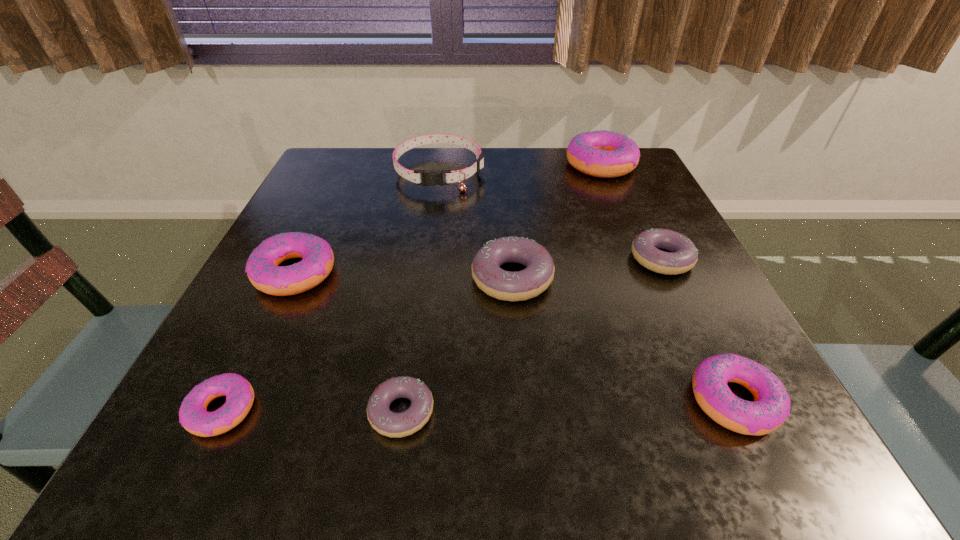
Identify the location of vacant area that lies between the smallest pink doughnut and the smallest purple doughnut. Image resolution: width=960 pixels, height=540 pixels. (312, 410).

You are a GUI agent. You are given a task and a screenshot of the screen. Output one action in this format:
    pyautogui.click(x=<x>, y=<y>)
    Task: Click on the vacant area that lies between the pink dog collar and the second farthest pink doughnut
    
    Given the screenshot: What is the action you would take?
    pyautogui.click(x=368, y=222)

Where is `unoccupied position between the second purple doughnut from right to left and the smallest purple doughnut`? The image size is (960, 540). unoccupied position between the second purple doughnut from right to left and the smallest purple doughnut is located at coordinates (457, 345).

At what (x,y) coordinates should I click in order to perform the action: click on unoccupied area between the pink dog collar and the third biggest pink doughnut. Please return your answer as a coordinate pair (x, y). Looking at the image, I should click on coord(587,286).

At what (x,y) coordinates should I click in order to perform the action: click on vacant region between the rightmost purple doughnut and the smallest pink doughnut. Please return your answer as a coordinate pair (x, y). The width and height of the screenshot is (960, 540). Looking at the image, I should click on (442, 334).

Find the location of a particular element. Image resolution: width=960 pixels, height=540 pixels. free space between the third biggest pink doughnut and the dog collar is located at coordinates (587, 286).

This screenshot has height=540, width=960. In order to click on vacant area between the pink dog collar and the fourth doughnut from left to right in this screenshot , I will do `click(476, 225)`.

This screenshot has height=540, width=960. I want to click on vacant space in between the farthest pink doughnut and the third biggest pink doughnut, so [x=666, y=282].

I want to click on vacant space that is in between the farthest pink doughnut and the third smallest pink doughnut, so click(447, 218).

I want to click on free space between the smallest pink doughnut and the leftmost purple doughnut, so click(x=312, y=410).